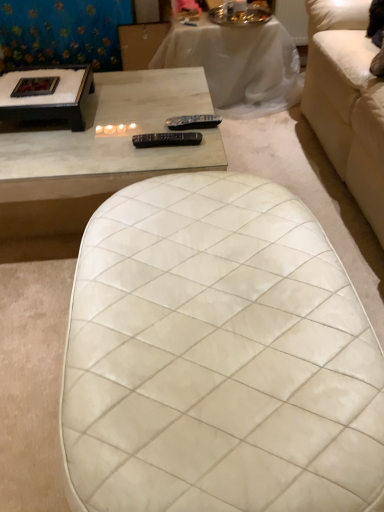
At what (x,y) coordinates should I click in order to perform the action: click on free space in front of black plastic remote at center, which ranks as the first remote in top-to-bottom order. Please return your answer as a coordinate pair (x, y). Looking at the image, I should click on (188, 152).